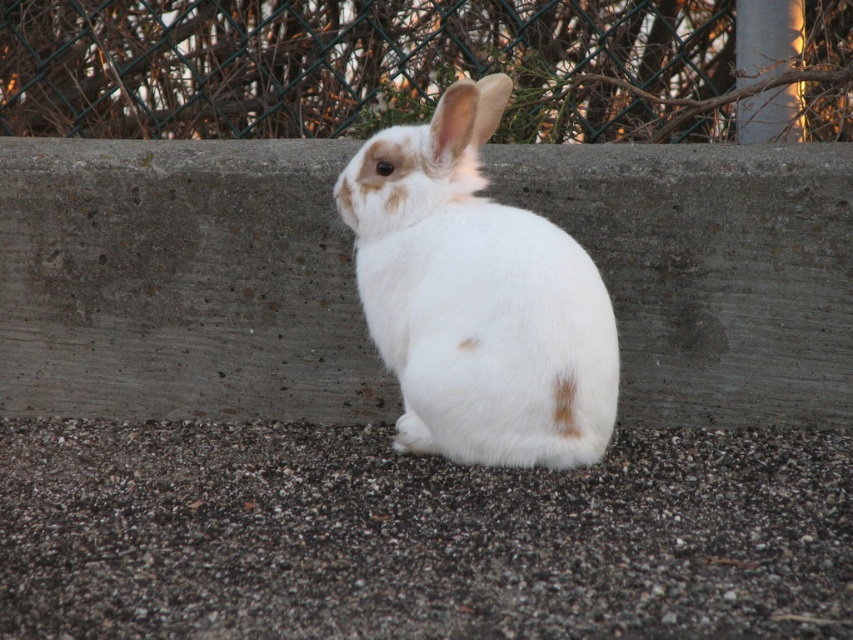
Consider the image. Does gray gravel at lower center appear over green wire mesh at upper center?

No, gray gravel at lower center is not above green wire mesh at upper center.

At what (x,y) coordinates should I click in order to perform the action: click on gray gravel at lower center. Please return your answer as a coordinate pair (x, y). This screenshot has width=853, height=640. Looking at the image, I should click on (416, 536).

Does gray gravel at lower center have a lesser height compared to white fluffy rabbit at center?

Indeed, gray gravel at lower center has a lesser height compared to white fluffy rabbit at center.

Is point (109, 472) farther from viewer compared to point (529, 326)?

Yes, it is.

Locate an element on the screen. The image size is (853, 640). gray gravel at lower center is located at coordinates (416, 536).

Between gray concrete at center and white fluffy rabbit at center, which one appears on the right side from the viewer's perspective?

From the viewer's perspective, white fluffy rabbit at center appears more on the right side.

Does gray concrete at center have a greater height compared to white fluffy rabbit at center?

No.

Where is `gray concrete at center`? The width and height of the screenshot is (853, 640). gray concrete at center is located at coordinates (180, 282).